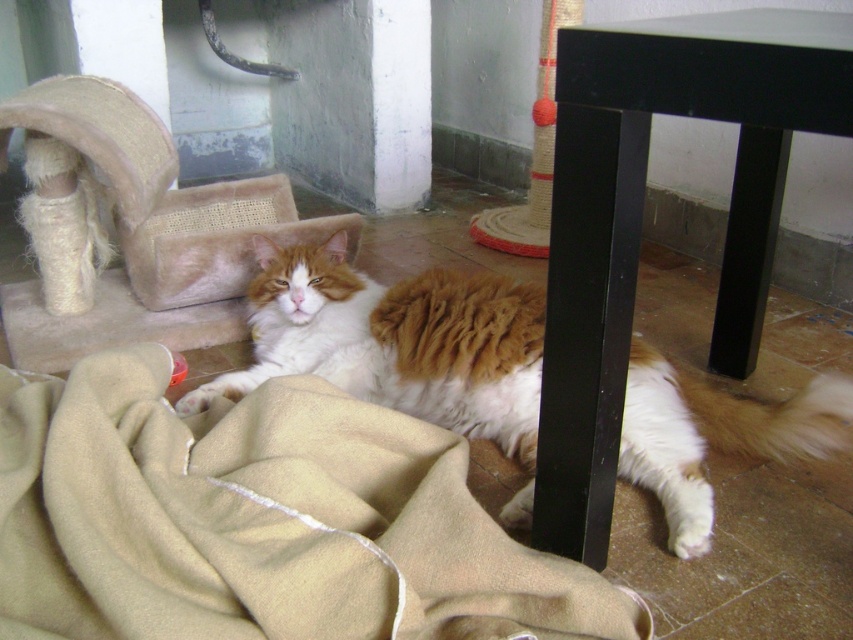
Between fuzzy orange-white cat at center and sisal-covered cat bed at upper left, which one has less height?

fuzzy orange-white cat at center

Which is below, fuzzy orange-white cat at center or sisal-covered cat bed at upper left?

fuzzy orange-white cat at center is below.

What do you see at coordinates (397, 340) in the screenshot? I see `fuzzy orange-white cat at center` at bounding box center [397, 340].

Where is `fuzzy orange-white cat at center`? The height and width of the screenshot is (640, 853). fuzzy orange-white cat at center is located at coordinates (397, 340).

Is beige woolen blanket at lower left to the left of sisal-covered cat bed at upper left from the viewer's perspective?

No, beige woolen blanket at lower left is not to the left of sisal-covered cat bed at upper left.

This screenshot has width=853, height=640. In order to click on beige woolen blanket at lower left in this screenshot , I will do `click(259, 522)`.

Where is `beige woolen blanket at lower left`? Image resolution: width=853 pixels, height=640 pixels. beige woolen blanket at lower left is located at coordinates (259, 522).

Can you confirm if beige woolen blanket at lower left is wider than fuzzy orange-white cat at center?

Incorrect, beige woolen blanket at lower left's width does not surpass fuzzy orange-white cat at center's.

Between point (408, 448) and point (462, 364), which one is positioned behind?

Positioned behind is point (462, 364).

Locate an element on the screen. This screenshot has height=640, width=853. beige woolen blanket at lower left is located at coordinates [259, 522].